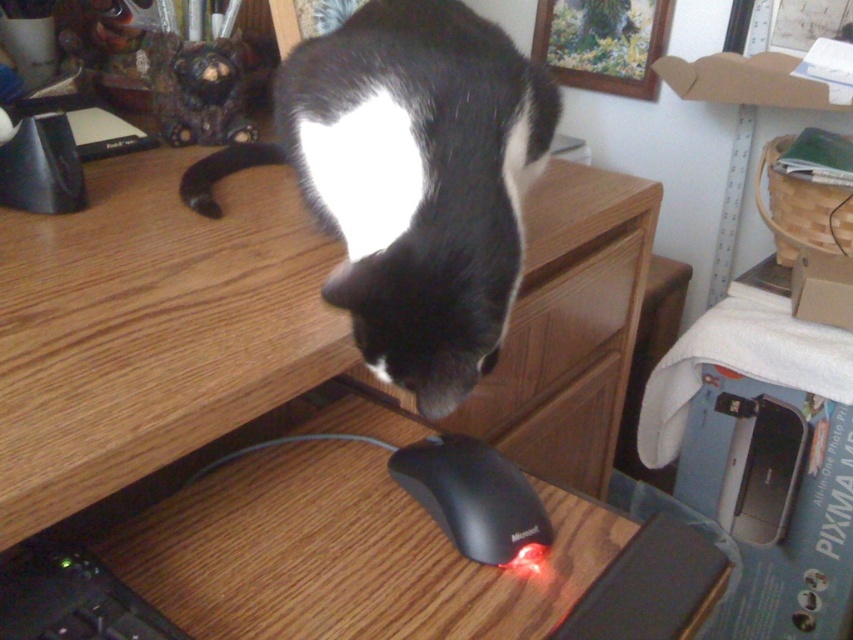
Question: Which point is farther to the camera?

Choices:
 (A) (596, 573)
 (B) (125, 625)
 (C) (467, 212)

Answer: (C)

Question: Does black matte fur cat at center have a lesser width compared to black matte keyboard at lower left?

Choices:
 (A) no
 (B) yes

Answer: (A)

Question: Does black matte fur cat at center appear over black matte keyboard at lower left?

Choices:
 (A) yes
 (B) no

Answer: (A)

Question: Which of the following is the closest to the observer?

Choices:
 (A) wooden at center
 (B) black matte keyboard at lower left

Answer: (A)

Question: Which point is closer to the camera?

Choices:
 (A) (482, 545)
 (B) (155, 289)

Answer: (A)

Question: Does wooden at center have a greater width compared to black matte keyboard at lower left?

Choices:
 (A) no
 (B) yes

Answer: (B)